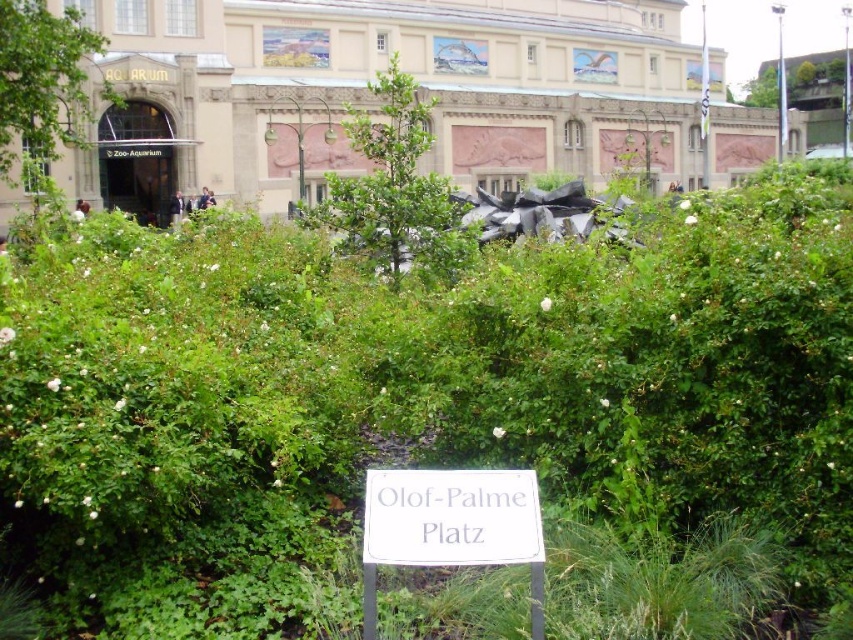
You are a visitor at the Olof Palme Platz garden. You see a green leafy bush at center and a white plastic sign at center. How far apart are these two objects from each other?

The distance between the green leafy bush at center and the white plastic sign at center is 45.11 meters.

You are a visitor at Olof Palme Platz and want to find the sign that says the name of the place. You see a green leafy bush at center and a white plastic sign at center. Which object is higher up in the scene?

The green leafy bush at center is located above the white plastic sign at center, so the green leafy bush at center is higher up in the scene.

You are standing in the garden and want to take a photo of the white plastic sign at center without the green leafy bush at center blocking it. How should you move?

Move backward to position yourself further away from the green leafy bush at center so that it is no longer blocking the view of the white plastic sign at center.